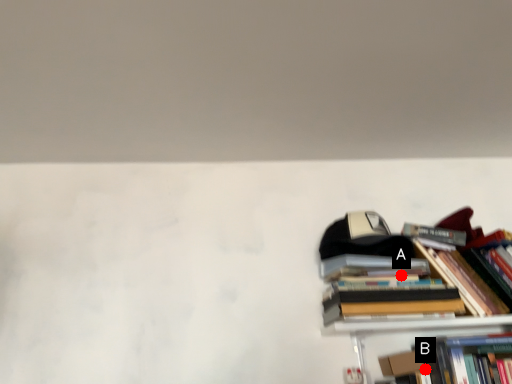
Question: Two points are circled on the image, labeled by A and B beside each circle. Which point is closer to the camera taking this photo?

Choices:
 (A) A is closer
 (B) B is closer

Answer: (B)